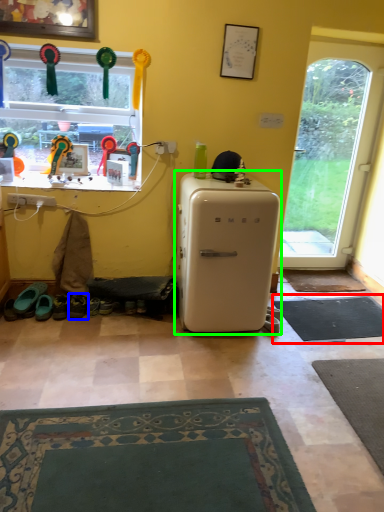
Question: Estimate the real-world distances between objects in this image. Which object is farther from doormat (highlighted by a red box), footwear (highlighted by a blue box) or refrigerator (highlighted by a green box)?

Choices:
 (A) footwear
 (B) refrigerator

Answer: (A)